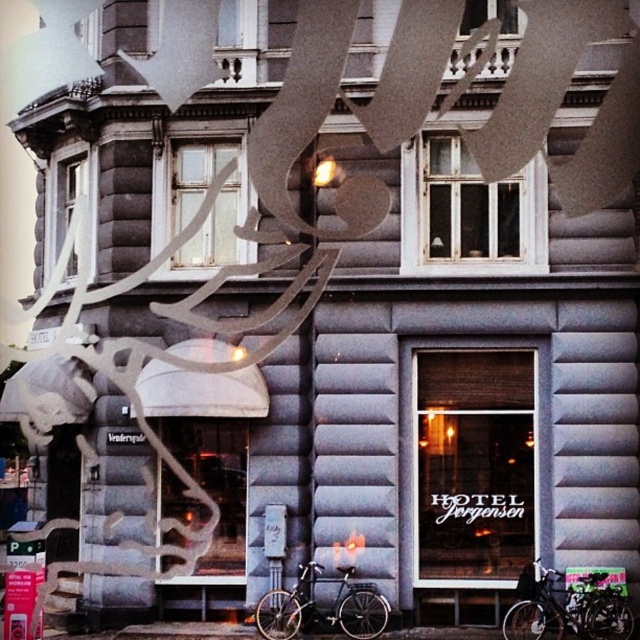
Between matte glass window at center and clear glass window at center, which one is positioned higher?

clear glass window at center is higher up.

Who is more distant from viewer, [456,435] or [451,138]?

Positioned behind is point [451,138].

The image size is (640, 640). I want to click on matte glass window at center, so 474,464.

Locate an element on the screen. matte glass window at center is located at coordinates (474, 464).

Between clear glass window at center and black matte bicycle at lower right, which one is positioned lower?

Positioned lower is black matte bicycle at lower right.

Between point (461, 241) and point (544, 616), which one is positioned in front?

Point (544, 616)

Which is in front, point (458, 163) or point (576, 632)?

Point (576, 632)

You are a GUI agent. You are given a task and a screenshot of the screen. Output one action in this format:
    pyautogui.click(x=<x>, y=<y>)
    Task: Click on the clear glass window at center
    
    Given the screenshot: What is the action you would take?
    pyautogui.click(x=470, y=205)

Is black matte bicycle at lower right smaller than white wooden window at center?

Actually, black matte bicycle at lower right might be larger than white wooden window at center.

Can you confirm if black matte bicycle at lower right is shorter than white wooden window at center?

Correct, black matte bicycle at lower right is not as tall as white wooden window at center.

Where is `black matte bicycle at lower right`? The height and width of the screenshot is (640, 640). black matte bicycle at lower right is located at coordinates (568, 609).